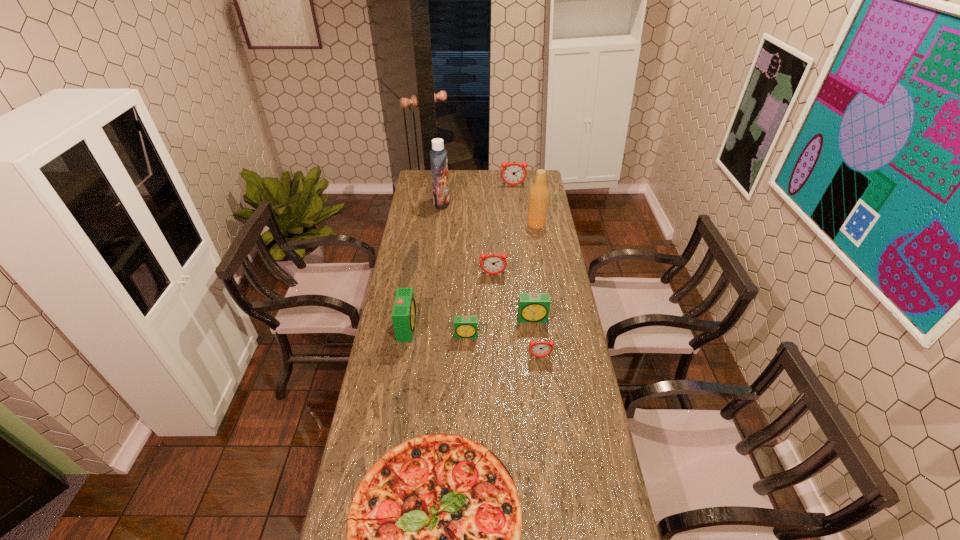
Identify which alarm clock is the fourth nearest to the nearest alarm clock. Please provide its 2D coordinates. Your answer should be formatted as a tuple, i.e. [(x, y)], where the tuple contains the x and y coordinates of a point satisfying the conditions above.

[(493, 263)]

Point out which alarm clock is positioned as the nearest to the farthest alarm clock. Please provide its 2D coordinates. Your answer should be formatted as a tuple, i.e. [(x, y)], where the tuple contains the x and y coordinates of a point satisfying the conditions above.

[(493, 263)]

Identify which reddish-pink alarm clock is the third closest to the leftmost green alarm clock. Please provide its 2D coordinates. Your answer should be formatted as a tuple, i.e. [(x, y)], where the tuple contains the x and y coordinates of a point satisfying the conditions above.

[(513, 173)]

Locate which reddish-pink alarm clock ranks second in proximity to the nearest alarm clock. Please provide its 2D coordinates. Your answer should be formatted as a tuple, i.e. [(x, y)], where the tuple contains the x and y coordinates of a point satisfying the conditions above.

[(513, 173)]

Locate which green alarm clock ranks second in proximity to the tan beer bottle. Please provide its 2D coordinates. Your answer should be formatted as a tuple, i.e. [(x, y)], where the tuple contains the x and y coordinates of a point satisfying the conditions above.

[(464, 326)]

Locate which green alarm clock is the second closest to the eighth farthest object. Please provide its 2D coordinates. Your answer should be formatted as a tuple, i.e. [(x, y)], where the tuple contains the x and y coordinates of a point satisfying the conditions above.

[(464, 326)]

In order to click on free space in the image that satisfies the following two spatial constraints: 1. on the front-facing side of the biggest reddish-pink alarm clock; 2. on the front label of the tallest object in this screenshot , I will do `click(516, 203)`.

At what (x,y) coordinates should I click in order to perform the action: click on free spot that satisfies the following two spatial constraints: 1. on the front-facing side of the farthest alarm clock; 2. on the left side of the seventh nearest object. Please return your answer as a coordinate pair (x, y). Looking at the image, I should click on (517, 224).